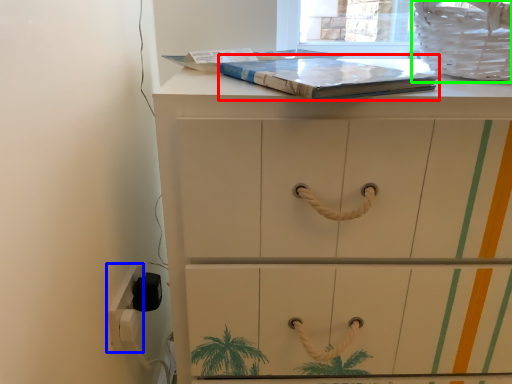
Question: Which object is positioned farthest from paperback book (highlighted by a red box)? Select from electric outlet (highlighted by a blue box) and laundry basket (highlighted by a green box).

Choices:
 (A) electric outlet
 (B) laundry basket

Answer: (A)